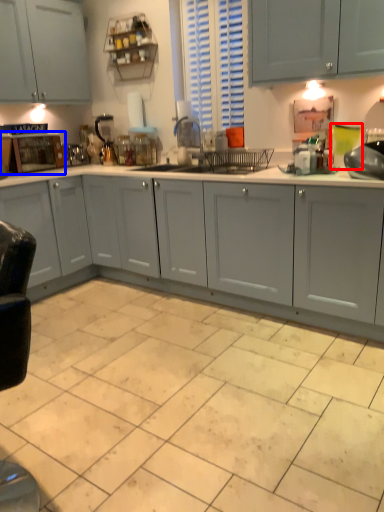
Question: Which object appears farthest to the camera in this image, teal (highlighted by a red box) or home appliance (highlighted by a blue box)?

Choices:
 (A) teal
 (B) home appliance

Answer: (B)